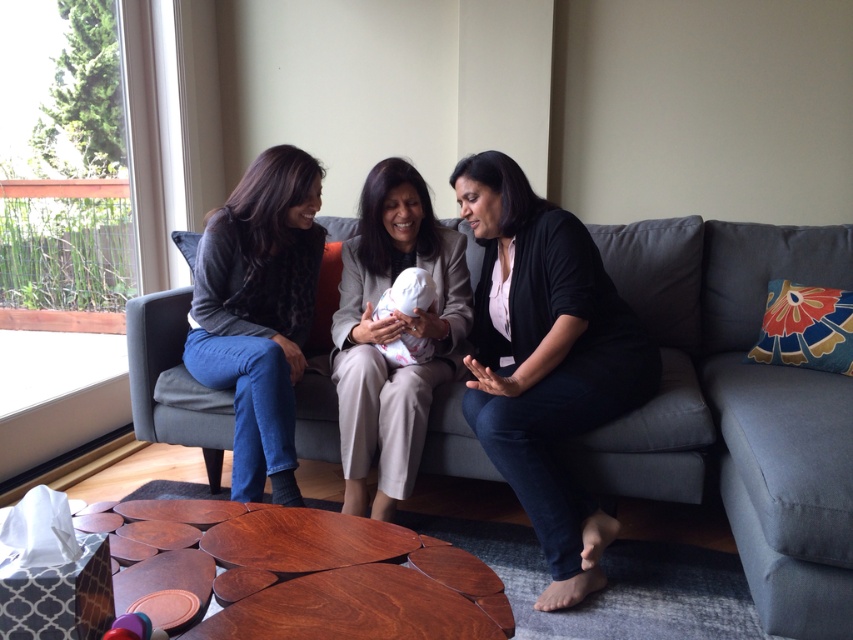
Question: Is the position of light beige fabric baby at center more distant than that of white soft baby at center?

Choices:
 (A) no
 (B) yes

Answer: (A)

Question: Which object is closer to the camera taking this photo?

Choices:
 (A) gray fabric couch at center
 (B) matte black sweater at left
 (C) black matte blazer at center

Answer: (A)

Question: Which point is closer to the camera?

Choices:
 (A) (521, 378)
 (B) (415, 310)
 (C) (368, 209)

Answer: (A)

Question: Is gray fabric couch at center wider than matte black sweater at left?

Choices:
 (A) yes
 (B) no

Answer: (A)

Question: Which of the following is the closest to the observer?

Choices:
 (A) (215, 416)
 (B) (299, 221)
 (C) (421, 353)
 (D) (450, 378)

Answer: (C)

Question: From the image, what is the correct spatial relationship of black matte blazer at center in relation to white soft baby at center?

Choices:
 (A) right
 (B) left

Answer: (A)